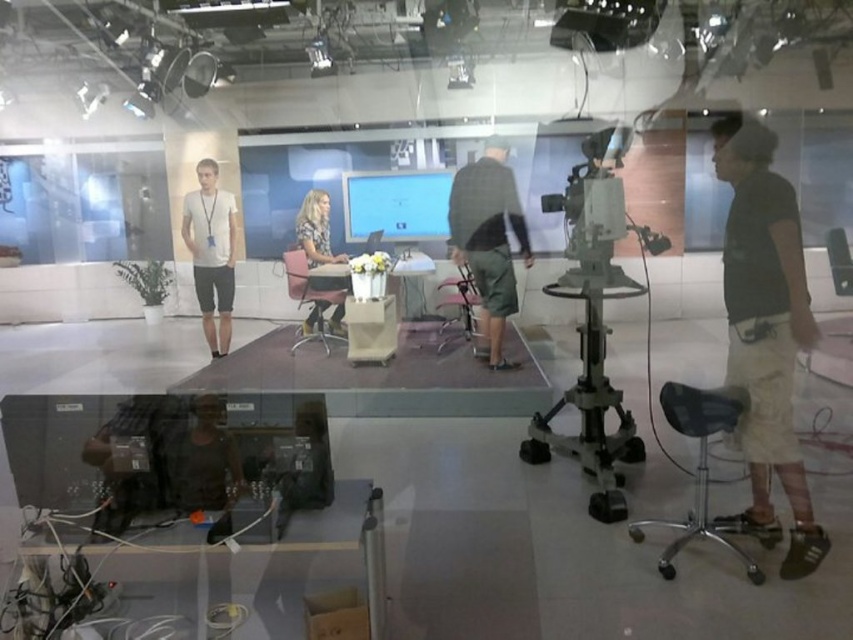
Question: Which of the following is the farthest from the observer?

Choices:
 (A) (184, 208)
 (B) (657, 520)
 (C) (643, 40)
 (D) (473, 326)

Answer: (D)

Question: Can you confirm if black cotton shirt at right is smaller than green plaid shirt at center?

Choices:
 (A) yes
 (B) no

Answer: (A)

Question: Which of these objects is positioned farthest from the pink fabric chair at center?

Choices:
 (A) metallic tripod camera at center
 (B) patterned fabric blouse at center
 (C) green plaid shirt at center

Answer: (A)

Question: Is black plastic stool at lower right positioned behind black plastic projector at upper center?

Choices:
 (A) yes
 (B) no

Answer: (B)

Question: Estimate the real-world distances between objects in this image. Which object is closer to the black cotton shirt at right?

Choices:
 (A) black plastic projector at upper center
 (B) patterned fabric blouse at center
 (C) pink fabric chair at center
 (D) white matte t-shirt at left

Answer: (A)

Question: Does black plastic stool at lower right have a lesser width compared to white matte t-shirt at left?

Choices:
 (A) yes
 (B) no

Answer: (B)